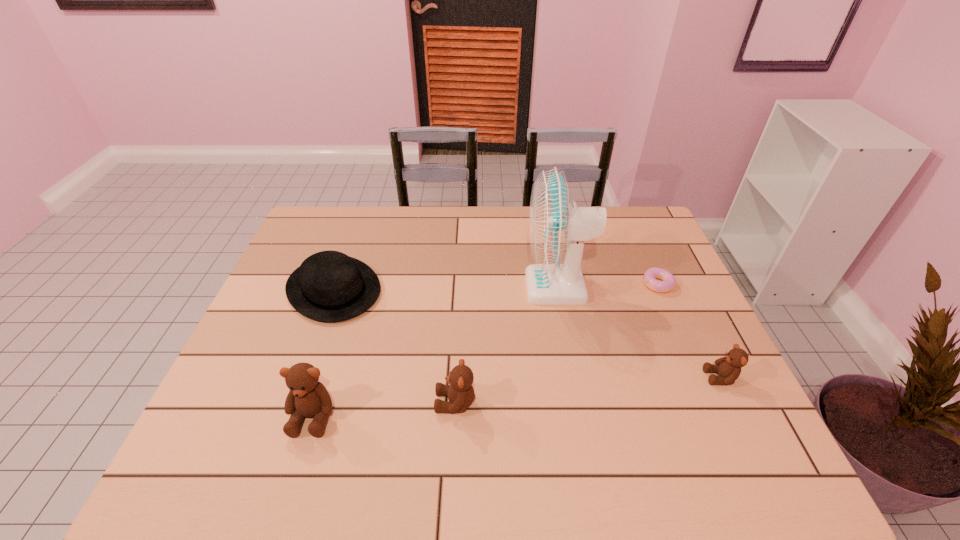
Where is `free location located on the face of the second teddy bear from right to left`? The image size is (960, 540). free location located on the face of the second teddy bear from right to left is located at coordinates pos(358,402).

I want to click on vacant space located on the face of the second teddy bear from right to left, so click(337, 402).

Find the location of a particular element. The image size is (960, 540). vacant area situated 0.390m on the face of the rightmost teddy bear is located at coordinates (545, 377).

The height and width of the screenshot is (540, 960). In order to click on vacant space situated on the face of the rightmost teddy bear in this screenshot , I will do `click(668, 377)`.

What are the coordinates of `free location located on the face of the rightmost teddy bear` in the screenshot? It's located at (652, 377).

I want to click on free space located on the front of the fedora, so click(294, 402).

This screenshot has width=960, height=540. Identify the location of free space located 0.120m on the back of the doughnut. (643, 250).

You are a GUI agent. You are given a task and a screenshot of the screen. Output one action in this format:
    pyautogui.click(x=<x>, y=<y>)
    Task: Click on the vacant space positioned 0.370m in front of the third object from right to left to face the airflow
    The image size is (960, 540).
    Given the screenshot: What is the action you would take?
    pyautogui.click(x=401, y=286)

You are a GUI agent. You are given a task and a screenshot of the screen. Output one action in this format:
    pyautogui.click(x=<x>, y=<y>)
    Task: Click on the free location located in front of the third object from right to left to face the airflow
    The height and width of the screenshot is (540, 960).
    Given the screenshot: What is the action you would take?
    pyautogui.click(x=485, y=286)

Identify the location of vacant space situated in front of the third object from right to left to face the airflow. Image resolution: width=960 pixels, height=540 pixels. (478, 286).